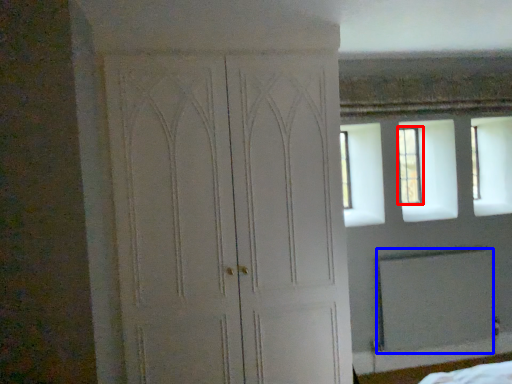
Question: Which object appears closest to the camera in this image, window (highlighted by a red box) or screen door (highlighted by a blue box)?

Choices:
 (A) window
 (B) screen door

Answer: (B)